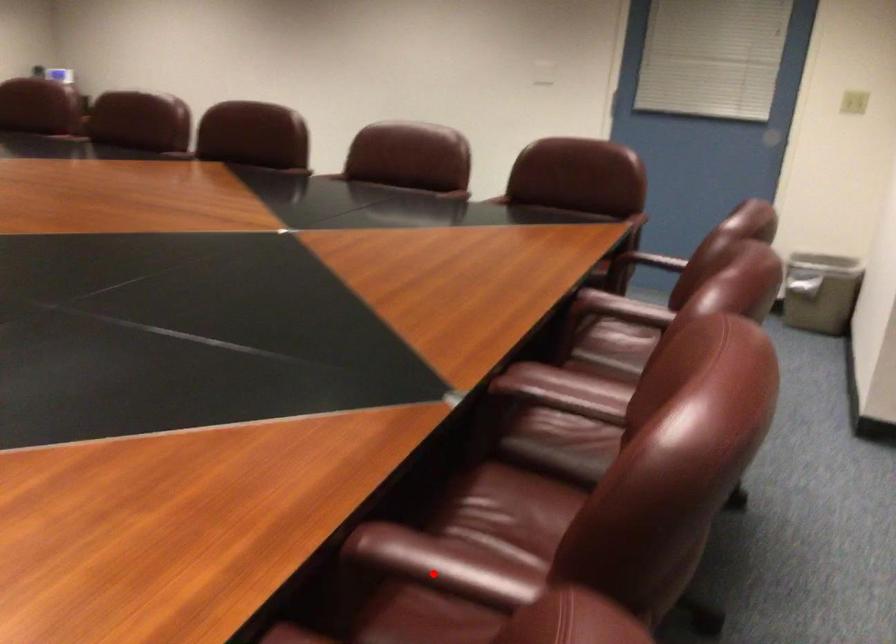
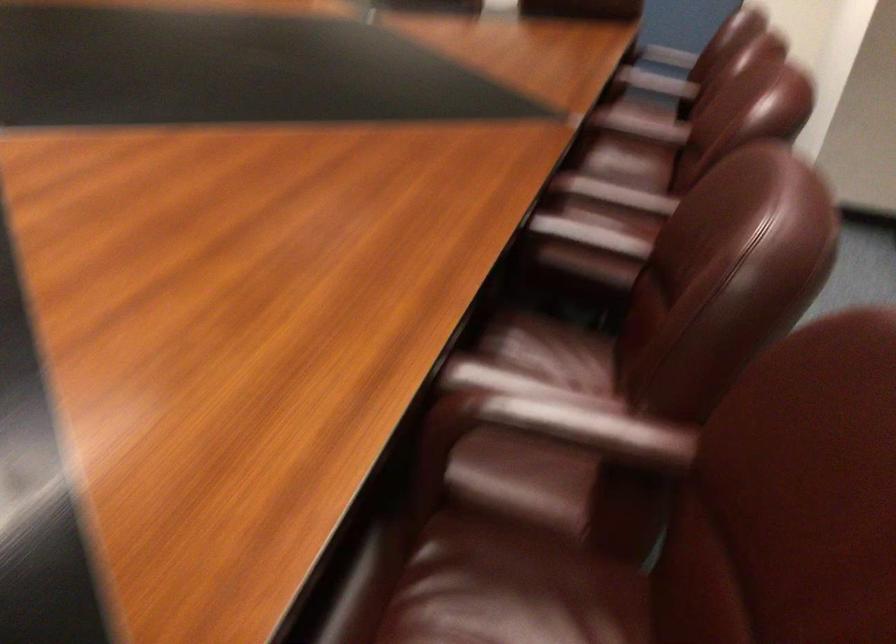
In the second image, find the point that corresponds to the highlighted location in the first image.

(613, 194)